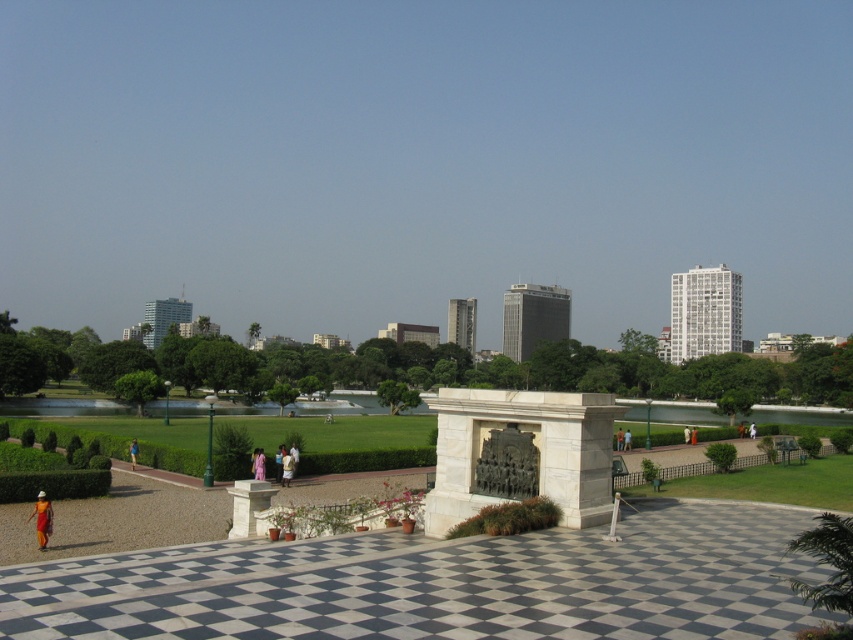
You are a photographer planning to capture both the orange fabric dress at lower left and the light purple fabric at center in a single frame. Which fabric should you focus on first to ensure both fit in the shot?

The orange fabric dress at lower left has a larger width than the light purple fabric at center, so focusing on the orange fabric dress at lower left first will help ensure both fit in the shot.

You are a photographer planning to take a picture of the green grass at center and the light purple fabric at center in the urban park. Which object should you focus on first if you want to capture both in a single frame without moving the camera?

The green grass at center should be focused on first because its width is larger than the light purple fabric at center, allowing it to dominate the frame while still including the smaller light purple fabric at center.